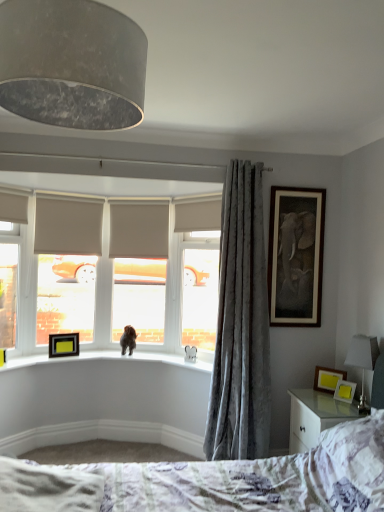
The width and height of the screenshot is (384, 512). What are the coordinates of `vacant space behind white plush elephant at window, positioned as the 2th animal in left-to-right order` in the screenshot? It's located at (186, 359).